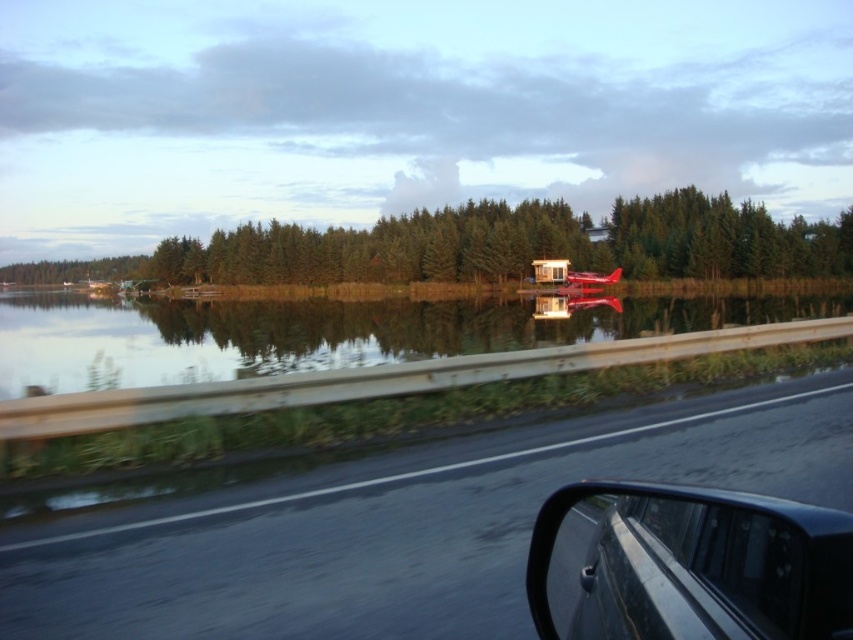
You are driving along a lakeside road and notice a black glossy car at lower right and green matte trees at center. Which object appears narrower from your perspective?

The black glossy car at lower right appears narrower than the green matte trees at center.

You are driving along the black asphalt highway at center and notice the smooth water at center in the distance. Which one is nearer to your car?

The black asphalt highway at center is closer to the viewer than the smooth water at center, so the highway is nearer to your car.